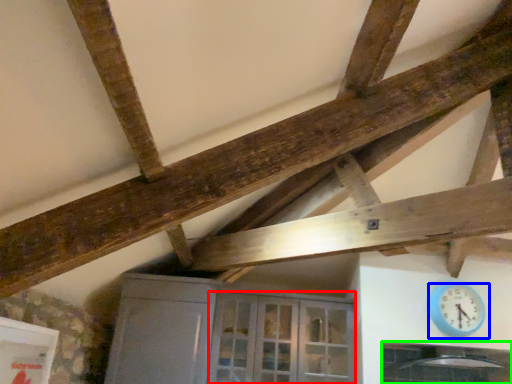
Question: Estimate the real-world distances between objects in this image. Which object is closer to glass door (highlighted by a red box), wall clock (highlighted by a blue box) or window (highlighted by a green box)?

Choices:
 (A) wall clock
 (B) window

Answer: (B)